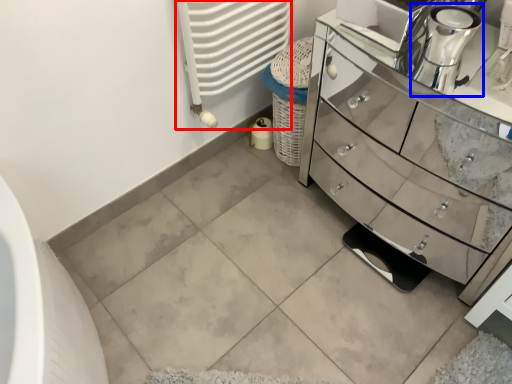
Question: Among these objects, which one is nearest to the camera, radiator (highlighted by a red box) or coffee machine (highlighted by a blue box)?

Choices:
 (A) radiator
 (B) coffee machine

Answer: (B)